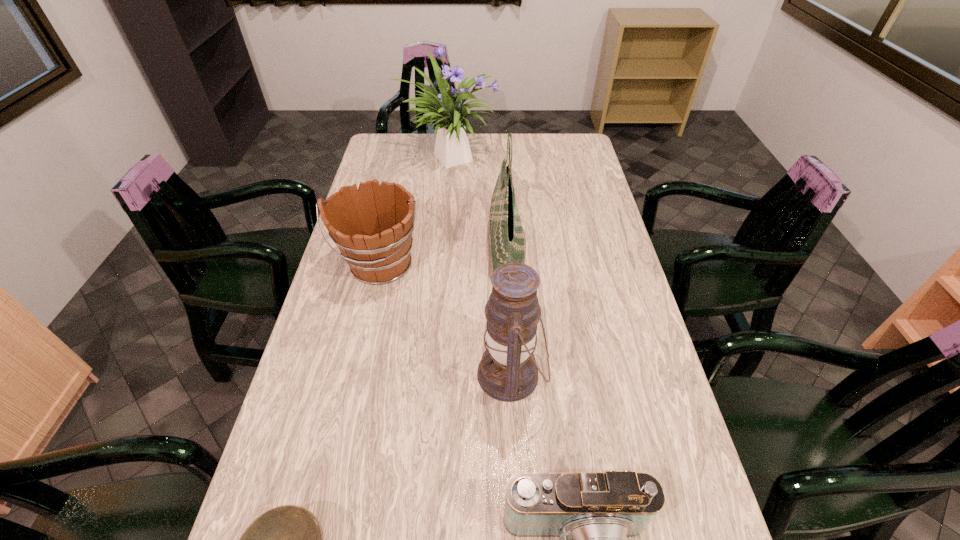
Locate an element on the screen. The height and width of the screenshot is (540, 960). flower arrangement is located at coordinates (452, 148).

Find the location of a particular element. tote bag is located at coordinates (508, 244).

Locate an element on the screen. oil lamp is located at coordinates (507, 372).

Where is `wine bucket`? This screenshot has height=540, width=960. wine bucket is located at coordinates (372, 226).

Locate an element on the screen. free point located on the right of the flower arrangement is located at coordinates (533, 156).

Locate an element on the screen. This screenshot has width=960, height=540. free space located on the front of the tote bag is located at coordinates (x=512, y=355).

Where is `free space located on the left of the oil lamp`? free space located on the left of the oil lamp is located at coordinates tap(458, 374).

Where is `vacant point located 0.140m with the handle on the wine bucket`? vacant point located 0.140m with the handle on the wine bucket is located at coordinates (365, 333).

Find the location of a particular element. The image size is (960, 540). object located at the far edge is located at coordinates (452, 148).

Identify the location of flower arrangement located in the left edge section of the desktop. This screenshot has height=540, width=960. (452, 148).